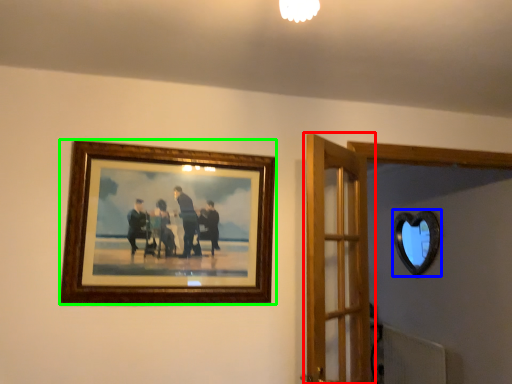
Question: Based on their relative distances, which object is nearer to door (highlighted by a red box)? Choose from mirror (highlighted by a blue box) and picture frame (highlighted by a green box).

Choices:
 (A) mirror
 (B) picture frame

Answer: (B)